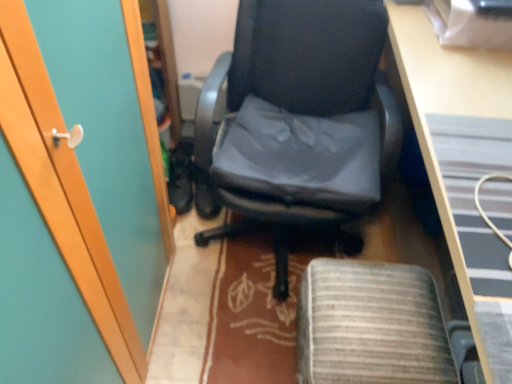
What do you see at coordinates (462, 165) in the screenshot?
I see `wooden desk at center` at bounding box center [462, 165].

You are a GUI agent. You are given a task and a screenshot of the screen. Output one action in this format:
    pyautogui.click(x=<x>, y=<y>)
    Task: Click on the black leather chair at center
    
    Given the screenshot: What is the action you would take?
    pyautogui.click(x=298, y=119)

At what (x,y) coordinates should I click in order to perform the action: click on black leather shoes at lower left. Please return your answer as a coordinate pair (x, y). Looking at the image, I should click on (181, 177).

Considering their positions, is black leather shoes at lower left located in front of or behind gray fabric computer chair at center?

black leather shoes at lower left is behind gray fabric computer chair at center.

Could you tell me if black leather shoes at lower left is turned towards gray fabric computer chair at center?

No, black leather shoes at lower left is not facing towards gray fabric computer chair at center.

From the image's perspective, between black leather shoes at lower left and gray fabric computer chair at center, who is located below?

gray fabric computer chair at center.

Consider the image. Between black leather shoes at lower left and gray fabric computer chair at center, which one has larger width?

With larger width is gray fabric computer chair at center.

In terms of width, does gray fabric computer chair at center look wider or thinner when compared to wooden desk at center?

Considering their sizes, gray fabric computer chair at center looks slimmer than wooden desk at center.

Which is less distant, [401,307] or [453,86]?

The point [401,307] is closer.

Is gray fabric computer chair at center touching wooden desk at center?

They are not placed beside each other.

Are gray fabric computer chair at center and black leather shoes at lower left beside each other?

No, gray fabric computer chair at center is not making contact with black leather shoes at lower left.

Is gray fabric computer chair at center bigger than black leather shoes at lower left?

Correct, gray fabric computer chair at center is larger in size than black leather shoes at lower left.

Which of these two, gray fabric computer chair at center or black leather shoes at lower left, stands shorter?

With less height is black leather shoes at lower left.

From a real-world perspective, which is physically below, gray fabric computer chair at center or black leather shoes at lower left?

From a 3D spatial view, black leather shoes at lower left is below.

From the image's perspective, which one is positioned lower, wooden desk at center or black leather chair at center?

wooden desk at center, from the image's perspective.

Is wooden desk at center at the left side of black leather chair at center?

No, wooden desk at center is not to the left of black leather chair at center.

Considering the relative sizes of wooden desk at center and black leather chair at center in the image provided, is wooden desk at center wider than black leather chair at center?

No.

Considering the relative sizes of wooden desk at center and black leather chair at center in the image provided, is wooden desk at center shorter than black leather chair at center?

Incorrect, the height of wooden desk at center does not fall short of that of black leather chair at center.

Is point (354, 204) behind point (485, 321)?

Yes, point (354, 204) is behind point (485, 321).

Is black leather chair at center turned away from wooden desk at center?

No.

Which object is thinner, black leather chair at center or wooden desk at center?

wooden desk at center is thinner.

From a real-world perspective, which object rests below the other?

black leather chair at center.

Do you think black leather shoes at lower left is within black leather chair at center, or outside of it?

black leather shoes at lower left is not enclosed by black leather chair at center.

Consider the image. Is black leather shoes at lower left facing away from black leather chair at center?

No, black leather shoes at lower left is not facing the opposite direction of black leather chair at center.

At what (x,y) coordinates should I click in order to perform the action: click on footwear on the left of black leather chair at center. Please return your answer as a coordinate pair (x, y). The image size is (512, 384). Looking at the image, I should click on (181, 177).

Visually, is black leather shoes at lower left positioned to the left or to the right of wooden desk at center?

From the image, it's evident that black leather shoes at lower left is to the left of wooden desk at center.

Is black leather shoes at lower left positioned with its back to wooden desk at center?

No, black leather shoes at lower left is not facing away from wooden desk at center.

Image resolution: width=512 pixels, height=384 pixels. Identify the location of desk above the black leather shoes at lower left (from a real-world perspective). coord(462,165).

Does point (183, 185) appear closer or farther from the camera than point (468, 262)?

Clearly, point (183, 185) is more distant from the camera than point (468, 262).

Where is `footwear lying behind the gray fabric computer chair at center`? The width and height of the screenshot is (512, 384). footwear lying behind the gray fabric computer chair at center is located at coordinates (181, 177).

You are a GUI agent. You are given a task and a screenshot of the screen. Output one action in this format:
    pyautogui.click(x=<x>, y=<y>)
    Task: Click on the desk above the gray fabric computer chair at center (from a real-world perspective)
    The image size is (512, 384).
    Given the screenshot: What is the action you would take?
    462,165

Considering their positions, is wooden desk at center positioned closer to gray fabric computer chair at center than black leather chair at center?

Among the two, black leather chair at center is located nearer to gray fabric computer chair at center.

From the picture: Looking at the image, which one is located further to black leather chair at center, black leather shoes at lower left or gray fabric computer chair at center?

The object further to black leather chair at center is black leather shoes at lower left.

From the image, which object appears to be farther from wooden desk at center, black leather shoes at lower left or black leather chair at center?

black leather shoes at lower left.

Which object lies nearer to the anchor point black leather shoes at lower left, gray fabric computer chair at center or black leather chair at center?

Based on the image, black leather chair at center appears to be nearer to black leather shoes at lower left.

Which object lies further to the anchor point gray fabric computer chair at center, black leather shoes at lower left or black leather chair at center?

black leather shoes at lower left lies further to gray fabric computer chair at center than the other object.

Based on their spatial positions, is gray fabric computer chair at center or black leather shoes at lower left closer to black leather chair at center?

gray fabric computer chair at center is positioned closer to the anchor black leather chair at center.

Which object lies further to the anchor point gray fabric computer chair at center, black leather chair at center or wooden desk at center?

wooden desk at center lies further to gray fabric computer chair at center than the other object.

Which object lies further to the anchor point black leather chair at center, wooden desk at center or gray fabric computer chair at center?

gray fabric computer chair at center is positioned further to the anchor black leather chair at center.

The image size is (512, 384). In order to click on computer chair between black leather chair at center and black leather shoes at lower left along the z-axis in this screenshot , I will do `click(371, 325)`.

Find the location of a particular element. computer chair located between wooden desk at center and black leather shoes at lower left in the depth direction is located at coordinates (371, 325).

Where is `desk between black leather chair at center and gray fabric computer chair at center from top to bottom`? The image size is (512, 384). desk between black leather chair at center and gray fabric computer chair at center from top to bottom is located at coordinates (462, 165).

What are the coordinates of `chair positioned between wooden desk at center and black leather shoes at lower left from near to far` in the screenshot? It's located at (298, 119).